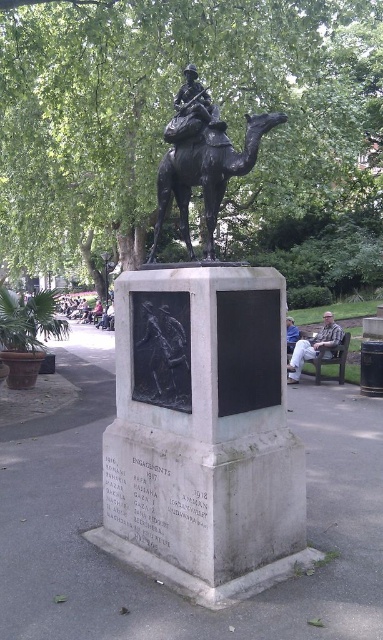
You are a park visitor standing at the entrance of the park. You want to take a photo of the bronze statue of camel at center. Which direction should you walk to face the statue properly?

The bronze statue of camel at center is located at point [206,173], so you should walk towards the center of the park to face the statue properly.

You are standing at point (x=186, y=136) and want to walk to point (x=364, y=120). Which direction should you face to walk directly towards your destination?

You should face north because point (x=364, y=120) is behind point (x=186, y=136), meaning it is in the northern direction.

You are a photographer trying to capture both the green leafy tree at upper center and the bronze statue of camel at center in a single frame. Which object is wider and would occupy more space horizontally in the photo?

The green leafy tree at upper center is wider than the bronze statue of camel at center, so it would occupy more horizontal space in the photo.